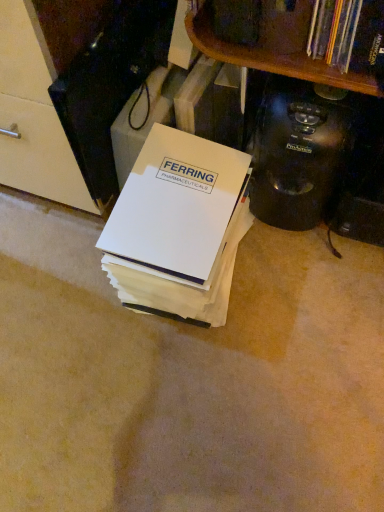
Question: Which is correct: black plastic coffee maker at right is inside white paper at center, or outside of it?

Choices:
 (A) inside
 (B) outside

Answer: (B)

Question: From the image's perspective, is black plastic coffee maker at right above or below white paper at center?

Choices:
 (A) above
 (B) below

Answer: (A)

Question: Based on their positions, is black plastic coffee maker at right located to the left or right of white paper at center?

Choices:
 (A) right
 (B) left

Answer: (A)

Question: From a real-world perspective, relative to black plastic coffee maker at right, is white paper at center vertically above or below?

Choices:
 (A) below
 (B) above

Answer: (A)

Question: Is white paper at center bigger or smaller than black plastic coffee maker at right?

Choices:
 (A) small
 (B) big

Answer: (B)

Question: Is white paper at center wider or thinner than black plastic coffee maker at right?

Choices:
 (A) thin
 (B) wide

Answer: (B)

Question: Do you think white paper at center is within black plastic coffee maker at right, or outside of it?

Choices:
 (A) inside
 (B) outside

Answer: (B)